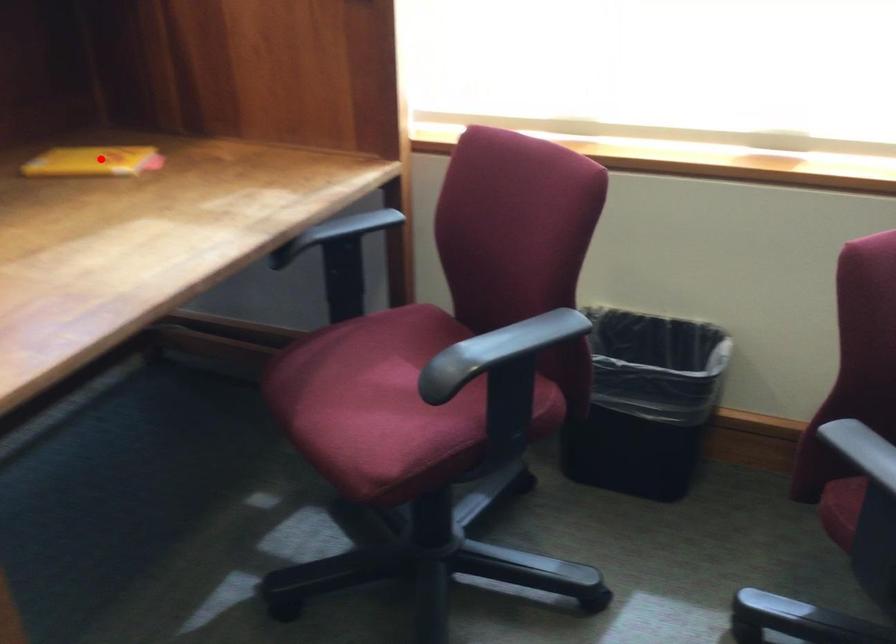
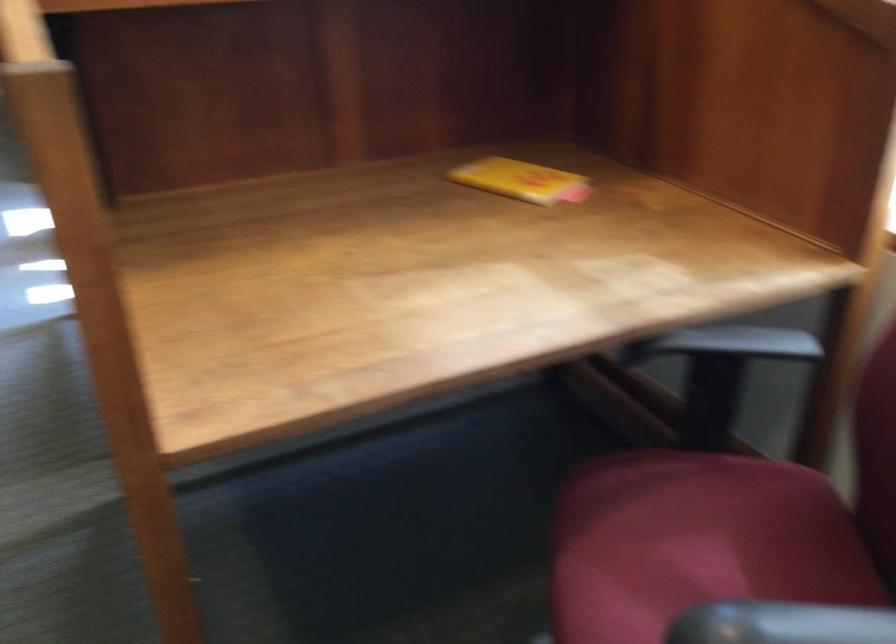
Where in the second image is the point corresponding to the highlighted location from the first image?

(521, 180)